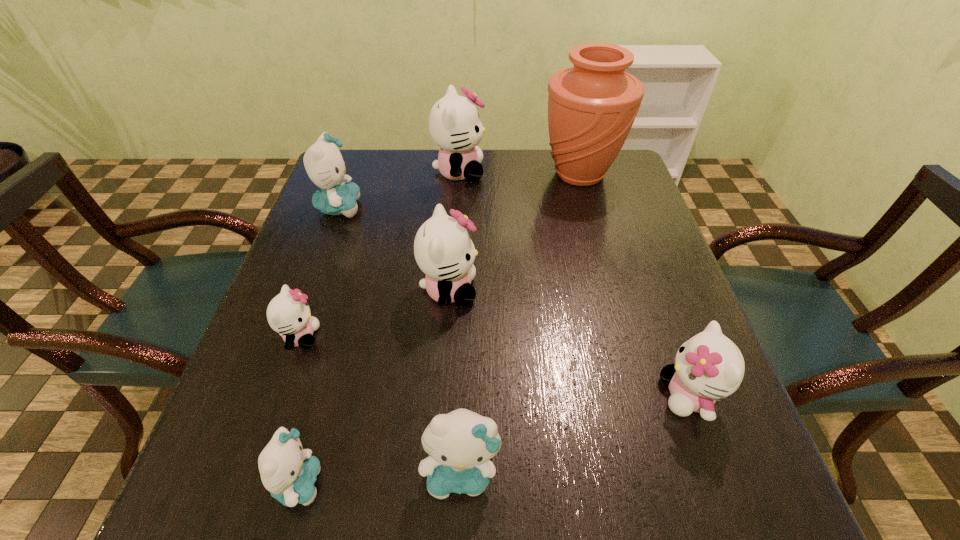
You are a GUI agent. You are given a task and a screenshot of the screen. Output one action in this format:
    pyautogui.click(x=<x>, y=<y>)
    Task: Click on the object that is the seventh closest to the second smallest blue kitten
    The image size is (960, 540).
    Given the screenshot: What is the action you would take?
    pyautogui.click(x=454, y=124)

Find the location of `the closest object relative to the second biggest white kitten`. the closest object relative to the second biggest white kitten is located at coordinates (288, 313).

Where is `kitten object that ranks as the fifth closest to the leftmost white kitten`? This screenshot has width=960, height=540. kitten object that ranks as the fifth closest to the leftmost white kitten is located at coordinates (454, 124).

Select which kitten appears as the second closest to the smallest blue kitten. Please provide its 2D coordinates. Your answer should be formatted as a tuple, i.e. [(x, y)], where the tuple contains the x and y coordinates of a point satisfying the conditions above.

[(288, 313)]

At what (x,y) coordinates should I click in order to perform the action: click on the third closest white kitten to the farthest blue kitten. Please return your answer as a coordinate pair (x, y). Looking at the image, I should click on (288, 313).

Select which white kitten appears as the third closest to the fifth farthest kitten. Please provide its 2D coordinates. Your answer should be formatted as a tuple, i.e. [(x, y)], where the tuple contains the x and y coordinates of a point satisfying the conditions above.

[(288, 313)]

Locate an element on the screen. blue kitten that stands as the closest to the third smallest white kitten is located at coordinates (324, 164).

Locate an element on the screen. blue kitten that is the second nearest to the farthest white kitten is located at coordinates (460, 444).

Where is `vacant point that satisfies the following two spatial constraints: 1. on the back side of the terracotta vase; 2. on the front-facing side of the farthest white kitten`? vacant point that satisfies the following two spatial constraints: 1. on the back side of the terracotta vase; 2. on the front-facing side of the farthest white kitten is located at coordinates (579, 172).

The width and height of the screenshot is (960, 540). What are the coordinates of `free space that satisfies the following two spatial constraints: 1. on the front side of the tallest object; 2. on the front-facing side of the leftmost white kitten` in the screenshot? It's located at (625, 336).